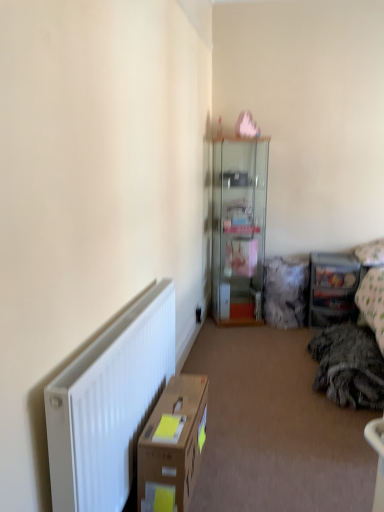
I want to click on free space in front of transparent glass cabinet at upper center, so click(x=249, y=336).